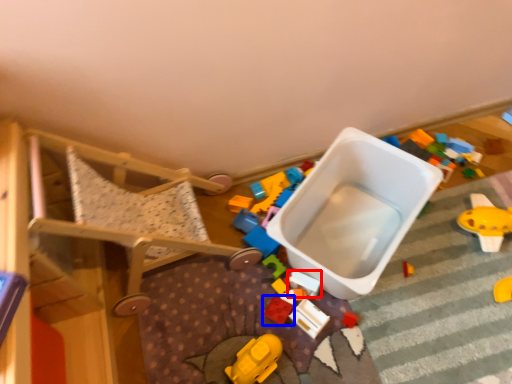
Question: Which object appears farthest to the camera in this image, toy (highlighted by a red box) or toy (highlighted by a blue box)?

Choices:
 (A) toy
 (B) toy

Answer: (B)